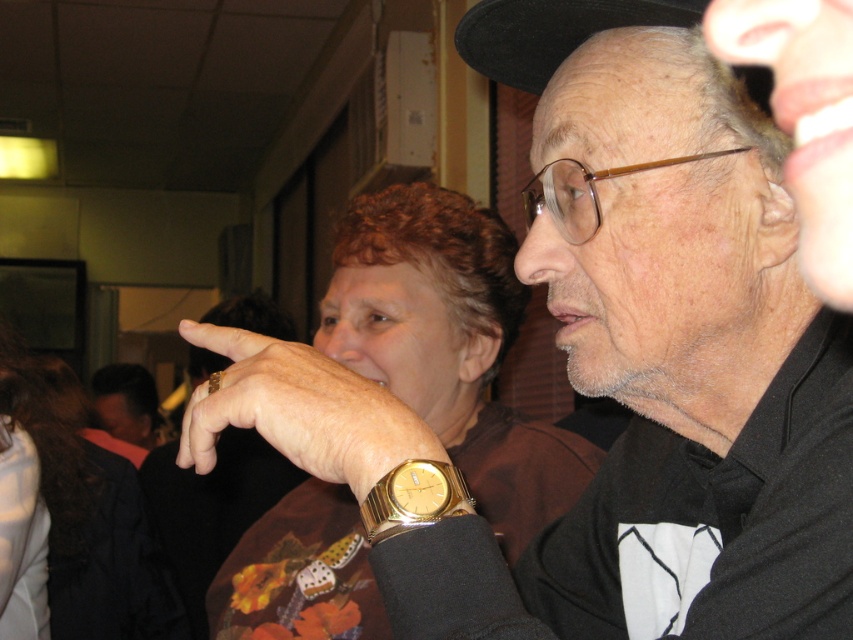
Find the location of a particular element. dry skin at ear right is located at coordinates (804, 116).

Image resolution: width=853 pixels, height=640 pixels. What do you see at coordinates (804, 116) in the screenshot?
I see `dry skin at ear right` at bounding box center [804, 116].

Where is `dry skin at ear right`? This screenshot has height=640, width=853. dry skin at ear right is located at coordinates (804, 116).

Who is positioned more to the left, brown fabric shirt at center or gold metallic watch at center?

From the viewer's perspective, gold metallic watch at center appears more on the left side.

Is brown fabric shirt at center to the right of gold metallic watch at center from the viewer's perspective?

Yes, brown fabric shirt at center is to the right of gold metallic watch at center.

The width and height of the screenshot is (853, 640). Find the location of `brown fabric shirt at center`. brown fabric shirt at center is located at coordinates tap(450, 346).

Locate an element on the screen. brown fabric shirt at center is located at coordinates (450, 346).

Which is more to the right, gold metallic watch at center or gold metallic watch at lower center?

gold metallic watch at lower center

The image size is (853, 640). I want to click on gold metallic watch at center, so click(300, 410).